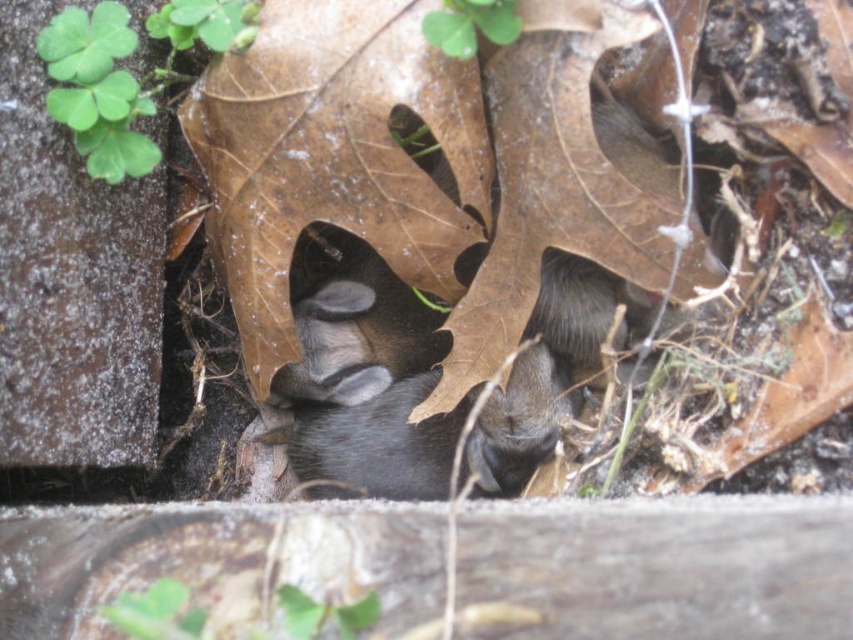
Question: Can you confirm if black fur at center is positioned below black matte fur at center?

Choices:
 (A) yes
 (B) no

Answer: (A)

Question: Which point is farther from the camera taking this photo?

Choices:
 (A) (326, 301)
 (B) (509, 374)

Answer: (A)

Question: Can you confirm if black fur at center is positioned to the left of black matte fur at center?

Choices:
 (A) yes
 (B) no

Answer: (B)

Question: Which object appears closest to the camera in this image?

Choices:
 (A) black fur at center
 (B) black matte fur at center

Answer: (B)

Question: Is black fur at center to the right of black matte fur at center from the viewer's perspective?

Choices:
 (A) yes
 (B) no

Answer: (A)